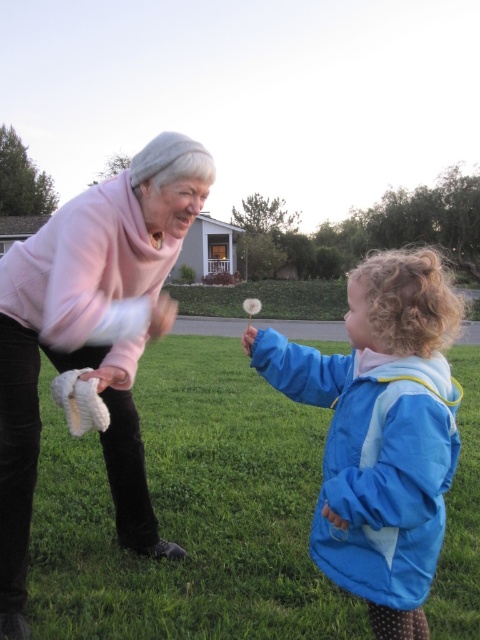
Can you confirm if green grass at center is wider than blue fabric dandelion at center?

Yes.

Is green grass at center closer to the viewer compared to blue fabric dandelion at center?

No, green grass at center is further to the viewer.

Identify the location of green grass at center. The image size is (480, 640). (189, 512).

Locate an element on the screen. green grass at center is located at coordinates (189, 512).

Who is lower down, pink fleece sweater at upper left or blue fabric dandelion at center?

blue fabric dandelion at center is below.

Who is more distant from viewer, (72, 211) or (357, 316)?

Positioned behind is point (72, 211).

What do you see at coordinates (92, 337) in the screenshot?
I see `pink fleece sweater at upper left` at bounding box center [92, 337].

Find the location of a particular element. This screenshot has height=640, width=480. pink fleece sweater at upper left is located at coordinates (92, 337).

Who is lower down, green grass at center or pink fleece sweater at upper left?

Positioned lower is green grass at center.

Does point (348, 604) come closer to viewer compared to point (21, 632)?

No, (348, 604) is further to viewer.

Find the location of a particular element. This screenshot has width=480, height=640. green grass at center is located at coordinates (189, 512).